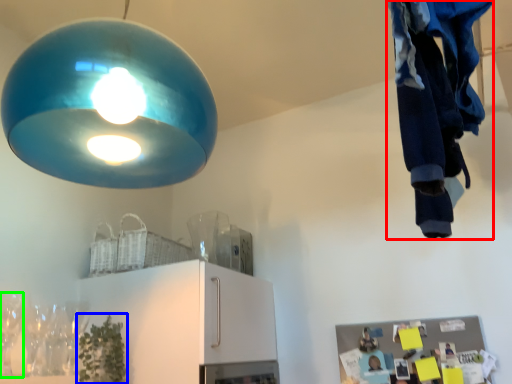
Question: Which object is positioned closest to clothing (highlighted by a red box)? Select from plant (highlighted by a blue box) and wine glass (highlighted by a green box).

Choices:
 (A) plant
 (B) wine glass

Answer: (A)